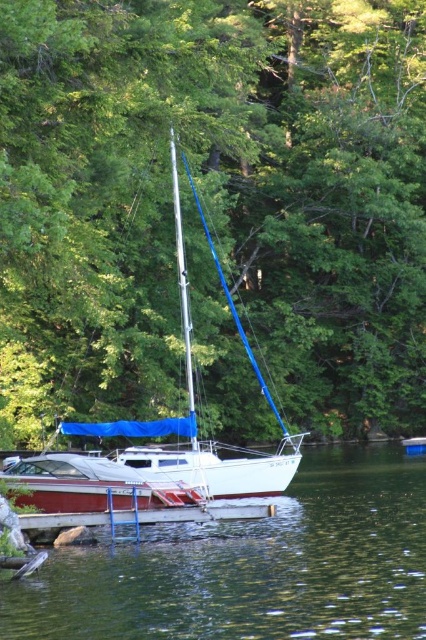
In order to click on green leafy tree at center in this screenshot , I will do `click(213, 212)`.

Can you confirm if green leafy tree at center is bigger than brown wooden dock at lower center?

Yes, green leafy tree at center is bigger than brown wooden dock at lower center.

Is point (65, 84) closer to camera compared to point (144, 518)?

No.

At what (x,y) coordinates should I click in order to perform the action: click on green leafy tree at center. Please return your answer as a coordinate pair (x, y). This screenshot has height=640, width=426. Looking at the image, I should click on (213, 212).

Is point (14, 80) in front of point (127, 632)?

No, (14, 80) is behind (127, 632).

Who is more distant from viewer, (353, 282) or (92, 628)?

The point (353, 282) is more distant.

The image size is (426, 640). In order to click on green leafy tree at center in this screenshot , I will do `click(213, 212)`.

Which is below, green liquid water at lower center or brown wooden dock at lower center?

green liquid water at lower center

Describe the element at coordinates (253, 566) in the screenshot. I see `green liquid water at lower center` at that location.

At what (x,y) coordinates should I click in order to perform the action: click on green liquid water at lower center. Please return your answer as a coordinate pair (x, y). The image size is (426, 640). Looking at the image, I should click on (253, 566).